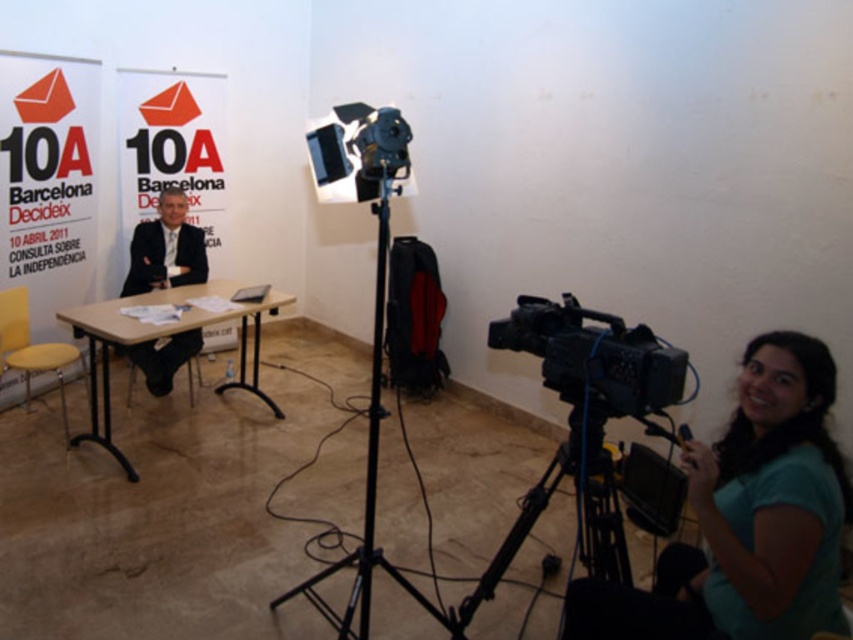
Question: Is teal matte shirt at lower right further to camera compared to light brown wood table at center?

Choices:
 (A) yes
 (B) no

Answer: (B)

Question: Does black plastic tripod at lower right have a larger size compared to matte black suit at center?

Choices:
 (A) no
 (B) yes

Answer: (B)

Question: Among these points, which one is farthest from the camera?

Choices:
 (A) (624, 369)
 (B) (65, 419)

Answer: (B)

Question: Which point is farther to the camera?

Choices:
 (A) black plastic camera at lower right
 (B) light brown wood table at center
 (C) black metal tripod at center

Answer: (B)

Question: Which of the following is the farthest from the observer?

Choices:
 (A) (68, 433)
 (B) (421, 604)
 (C) (596, 452)
 (D) (645, 362)

Answer: (A)

Question: In this image, where is black plastic camera at lower right located relative to black plastic tripod at lower right?

Choices:
 (A) below
 (B) above

Answer: (B)